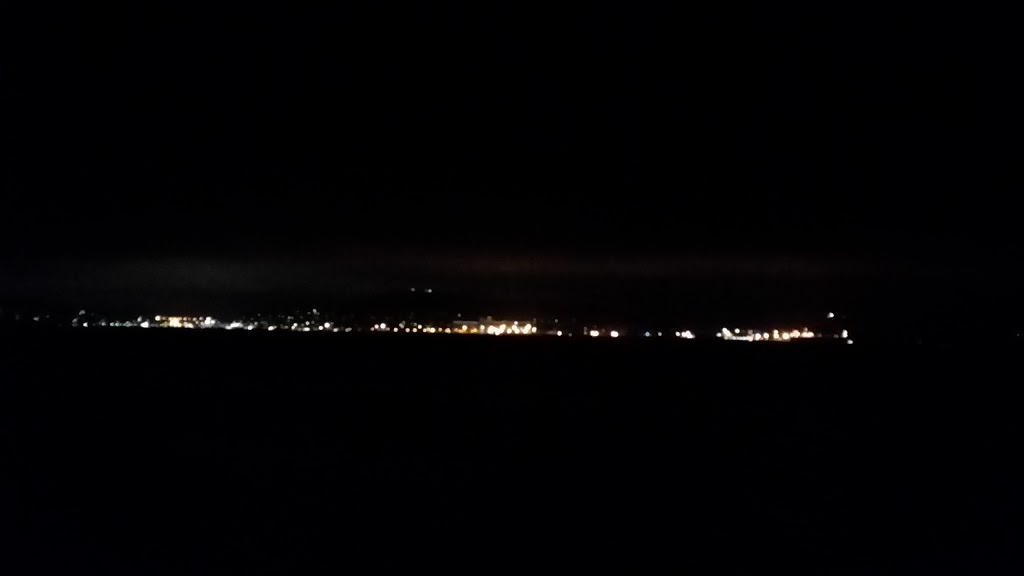
Image resolution: width=1024 pixels, height=576 pixels. In order to click on lights in this screenshot , I will do `click(513, 329)`.